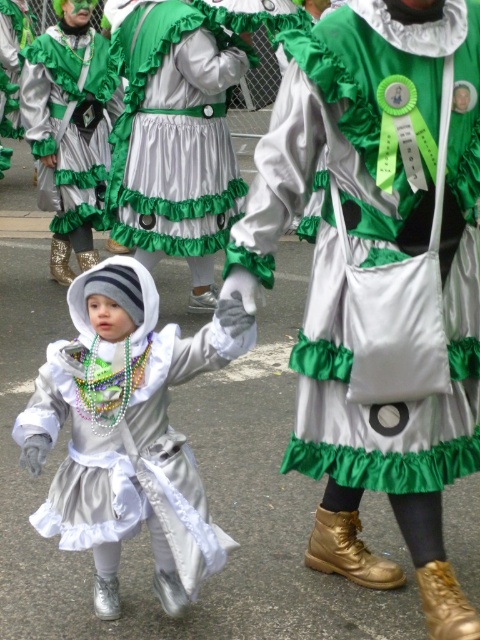
Question: Which is farther from the satin green purse at center?

Choices:
 (A) satin/green apron at center
 (B) satin silver dress at center

Answer: (A)

Question: Is satin/green apron at center above green satin dress at center?

Choices:
 (A) no
 (B) yes

Answer: (A)

Question: Considering the relative positions of satin green purse at center and satin silver dress at center in the image provided, where is satin green purse at center located with respect to satin silver dress at center?

Choices:
 (A) below
 (B) above

Answer: (B)

Question: Among these points, which one is farthest from the camera?

Choices:
 (A) (190, 76)
 (B) (334, 36)

Answer: (A)

Question: Among these points, which one is nearest to the camera?

Choices:
 (A) click(x=59, y=534)
 (B) click(x=117, y=129)
 (C) click(x=436, y=216)

Answer: (C)

Question: Is satin silver dress at center thinner than satin/green apron at center?

Choices:
 (A) yes
 (B) no

Answer: (A)